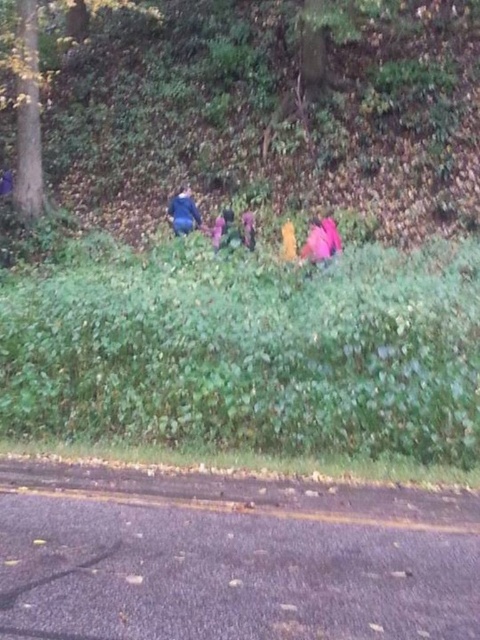
Question: Which object is the farthest from the blue fabric jacket at upper center?

Choices:
 (A) green matte tree at upper left
 (B) green leafy vegetation at center

Answer: (B)

Question: Observing the image, what is the correct spatial positioning of green leafy vegetation at center in reference to blue fabric jacket at upper center?

Choices:
 (A) above
 (B) below

Answer: (B)

Question: Can you confirm if green leafy vegetation at center is bigger than blue fabric jacket at upper center?

Choices:
 (A) yes
 (B) no

Answer: (A)

Question: Which of the following is the closest to the observer?

Choices:
 (A) blue fabric jacket at upper center
 (B) green leafy vegetation at center
 (C) green matte tree at upper left

Answer: (B)

Question: Can you confirm if green leafy vegetation at center is positioned to the left of blue fabric jacket at upper center?

Choices:
 (A) yes
 (B) no

Answer: (B)

Question: Which point is closer to the camera?

Choices:
 (A) (188, 202)
 (B) (64, 1)
 (C) (113, 435)

Answer: (C)